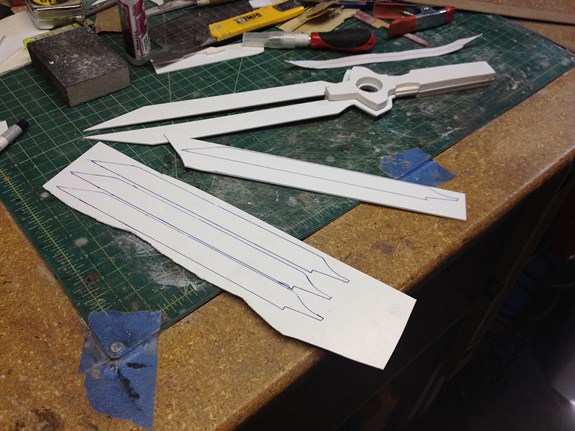
The image size is (575, 431). I want to click on countertop, so click(x=513, y=160).